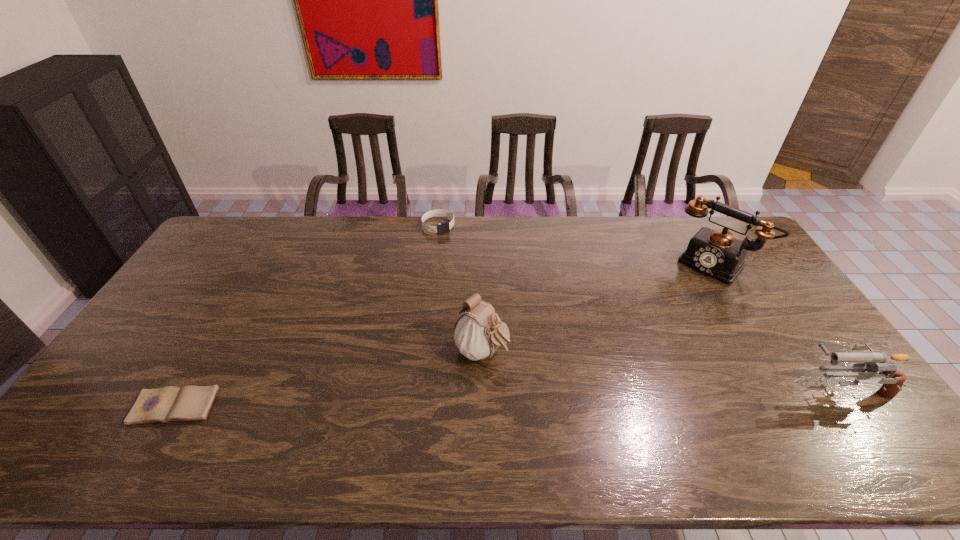
What are the coordinates of `vacant point located on the outer surface of the fourth object from right to left` in the screenshot? It's located at (452, 245).

Locate an element on the screen. The image size is (960, 540). telephone located at the far edge is located at coordinates [x=716, y=253].

The width and height of the screenshot is (960, 540). Find the location of `wristband situated at the far edge`. wristband situated at the far edge is located at coordinates (441, 228).

You are a GUI agent. You are given a task and a screenshot of the screen. Output one action in this format:
    pyautogui.click(x=<x>, y=<y>)
    Task: Click on the diary at the near edge
    The width and height of the screenshot is (960, 540).
    Given the screenshot: What is the action you would take?
    pyautogui.click(x=189, y=403)

Locate an element on the screen. gun positioned at the near edge is located at coordinates (872, 362).

Image resolution: width=960 pixels, height=540 pixels. Find the location of `object at the left edge`. object at the left edge is located at coordinates (189, 403).

Where is `gun that is at the right edge`? gun that is at the right edge is located at coordinates (872, 362).

Identify the location of telephone that is at the right edge. This screenshot has height=540, width=960. pos(716,253).

Identify the location of object present at the near left corner. This screenshot has width=960, height=540. (189, 403).

Identify the location of object present at the far right corner. [x=716, y=253].